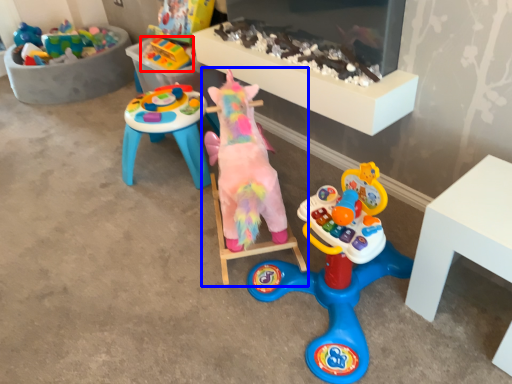
Question: Which of the following is the farthest to the observer, toy (highlighted by a red box) or toy (highlighted by a blue box)?

Choices:
 (A) toy
 (B) toy

Answer: (A)